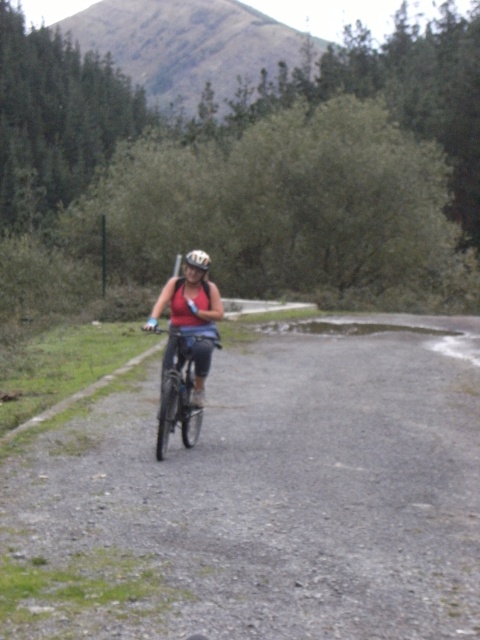
Does gravel road at center have a greater height compared to matte black helmet at center?

No.

Does gravel road at center appear under matte black helmet at center?

Yes.

Is point (348, 536) closer to viewer compared to point (199, 250)?

Yes.

The image size is (480, 640). Identify the location of gravel road at center. (278, 492).

Is point (458, 532) more distant than point (158, 440)?

No, it is in front of (158, 440).

Describe the element at coordinates (278, 492) in the screenshot. I see `gravel road at center` at that location.

Does point (352, 573) come in front of point (178, 368)?

Yes, point (352, 573) is closer to viewer.

Identify the location of gravel road at center. The image size is (480, 640). (278, 492).

Can you confirm if shiny metallic bicycle at center is positioned to the right of matte black helmet at center?

Indeed, shiny metallic bicycle at center is positioned on the right side of matte black helmet at center.

Is point (180, 392) closer to viewer compared to point (192, 262)?

Yes, point (180, 392) is in front of point (192, 262).

Find the location of `shiny metallic bicycle at center`. shiny metallic bicycle at center is located at coordinates (180, 388).